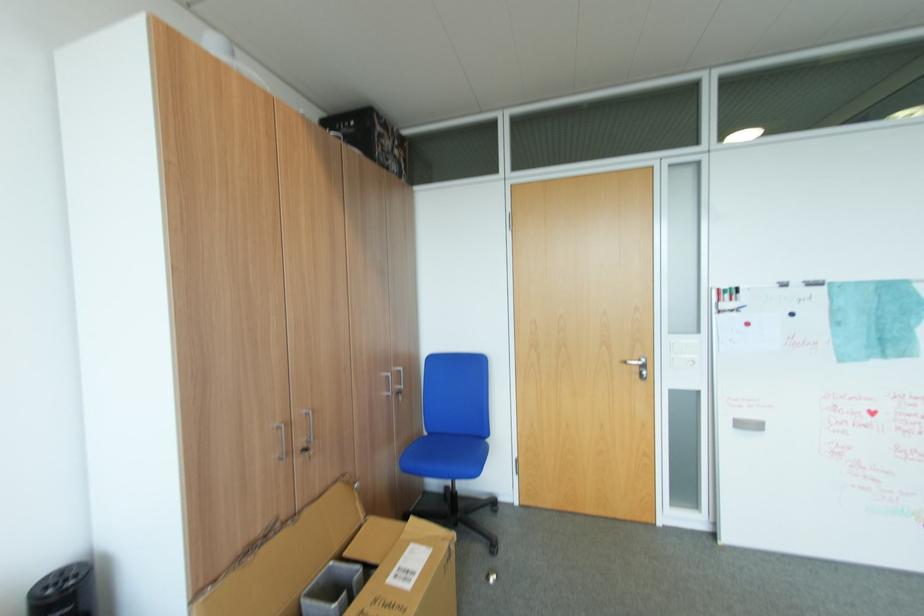
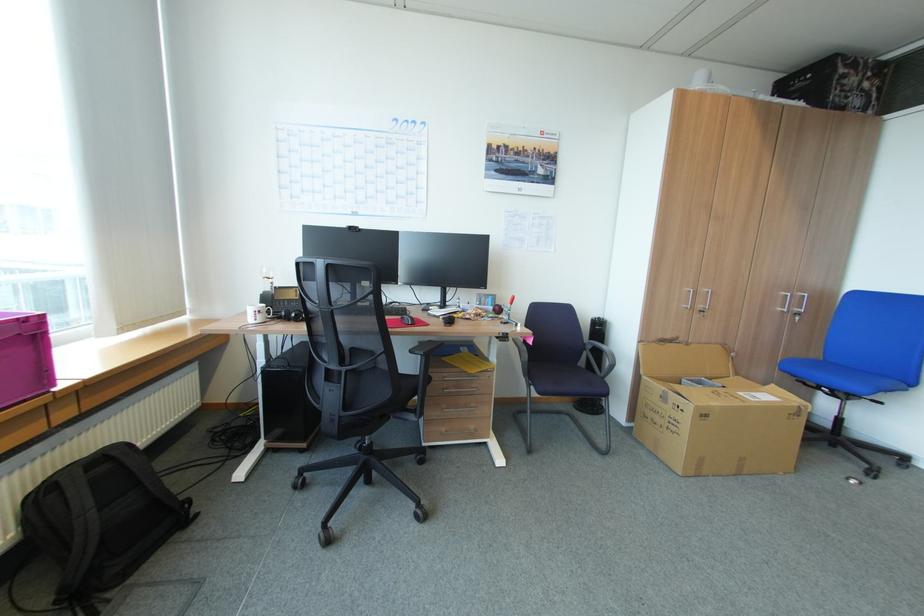
In the second image, find the point that corresponds to point (390, 394) in the first image.

(785, 309)